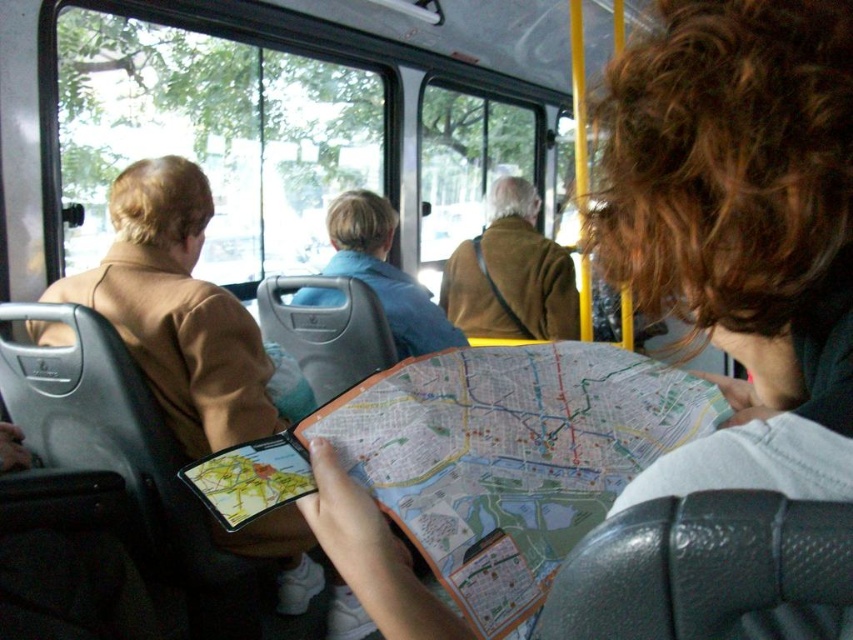
You are standing at the back of the bus and want to reach the front door. There is a brown woolen coat at center in your way. Based on its position, can you estimate how far you need to walk around it to reach the door?

The brown woolen coat at center is located at point (511, 275). Since the coordinate system is normalized, this means it is positioned 43.0 cm from the left edge and 60.0 cm from the bottom edge of the bus. To reach the front door, you would need to walk around it either to the left or right, depending on the available space. However, without additional information about the bus layout or the exact path to the door, it is difficult to provide an exact distance.

You are a passenger on the bus and you want to check the map to see where we are. Is the paper map at center visible to you without moving the blue cotton shirt at center?

The paper map at center is below the blue cotton shirt at center, so it might be partially or fully blocked by the shirt, making it difficult to see without moving the blue cotton shirt at center.